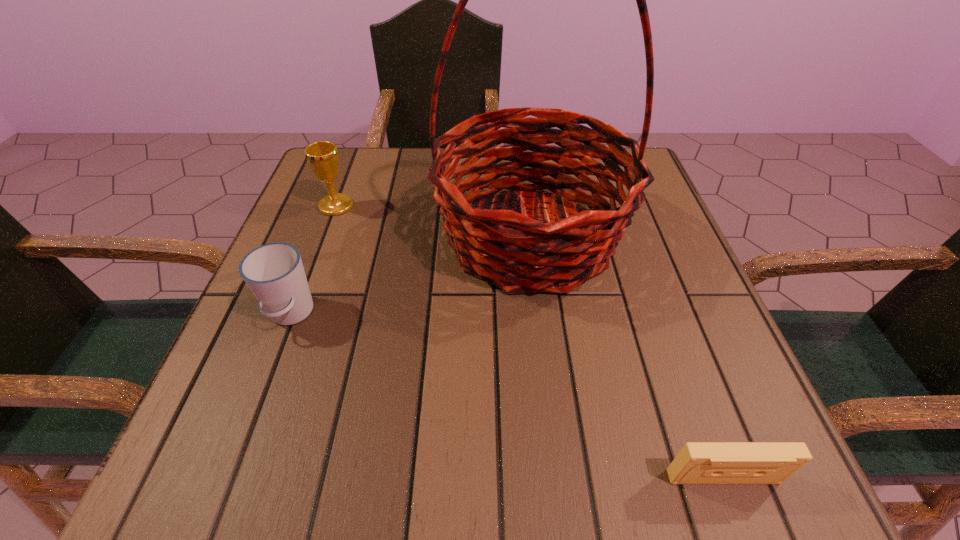
Find the location of a particular element. This screenshot has height=540, width=960. basket is located at coordinates (533, 256).

This screenshot has width=960, height=540. What are the coordinates of `chalice` in the screenshot? It's located at (322, 157).

I want to click on cup, so click(x=274, y=272).

At what (x,y) coordinates should I click in order to perform the action: click on the nearest object. Please return your answer as a coordinate pair (x, y). Looking at the image, I should click on (698, 462).

Where is `videotape`? This screenshot has height=540, width=960. videotape is located at coordinates (698, 462).

Find the location of a particular element. Image resolution: width=960 pixels, height=540 pixels. vacant space situated on the left of the basket is located at coordinates (372, 237).

Locate an element on the screen. The width and height of the screenshot is (960, 540). vacant space located 0.110m on the back of the chalice is located at coordinates point(349,169).

You are a GUI agent. You are given a task and a screenshot of the screen. Output one action in this format:
    pyautogui.click(x=<x>, y=<y>)
    Task: Click on the free point located with a handle on the side of the cup
    
    Given the screenshot: What is the action you would take?
    pyautogui.click(x=226, y=485)

I want to click on basket that is at the far edge, so click(533, 256).

This screenshot has height=540, width=960. What are the coordinates of `chalice at the far edge` in the screenshot? It's located at (322, 157).